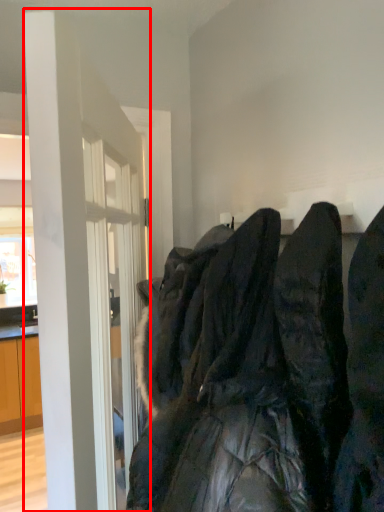
Question: In this image, where is door (annotated by the red box) located relative to laundry?

Choices:
 (A) right
 (B) left

Answer: (B)